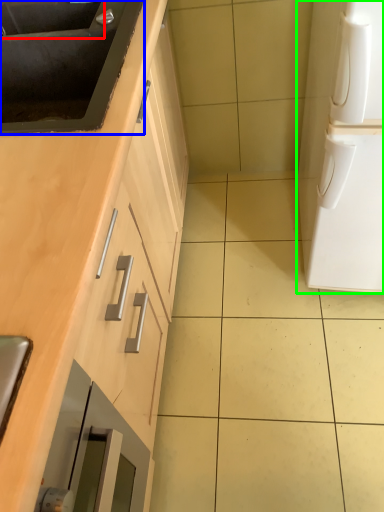
Question: Which is farther away from sink (highlighted by a red box)? sink (highlighted by a blue box) or home appliance (highlighted by a green box)?

Choices:
 (A) sink
 (B) home appliance

Answer: (B)